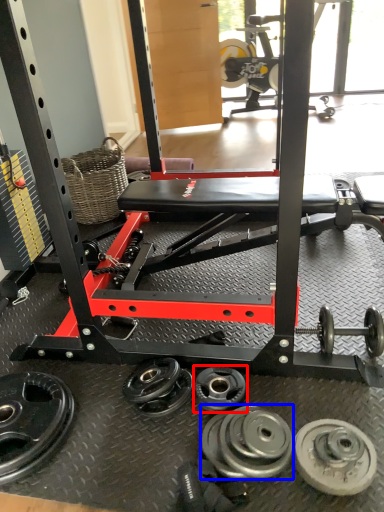
Question: Which object is closer to the camera taking this photo, wheel (highlighted by a red box) or wheel (highlighted by a blue box)?

Choices:
 (A) wheel
 (B) wheel

Answer: (B)